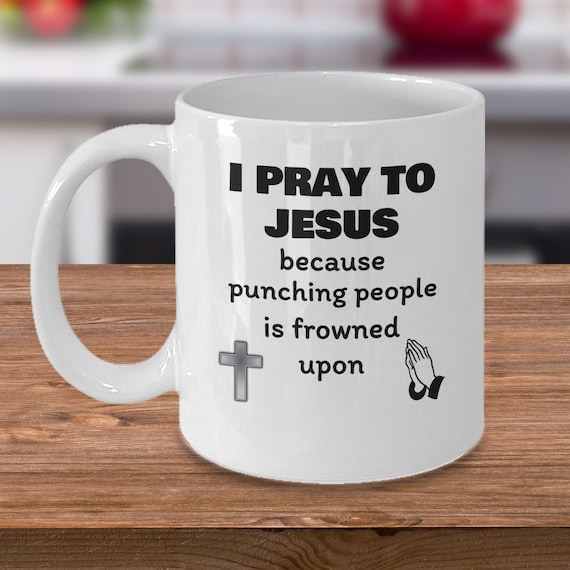
Identify the location of brown wooden table top, bottom. (524, 492), (522, 336), (173, 520), (38, 454), (121, 291).